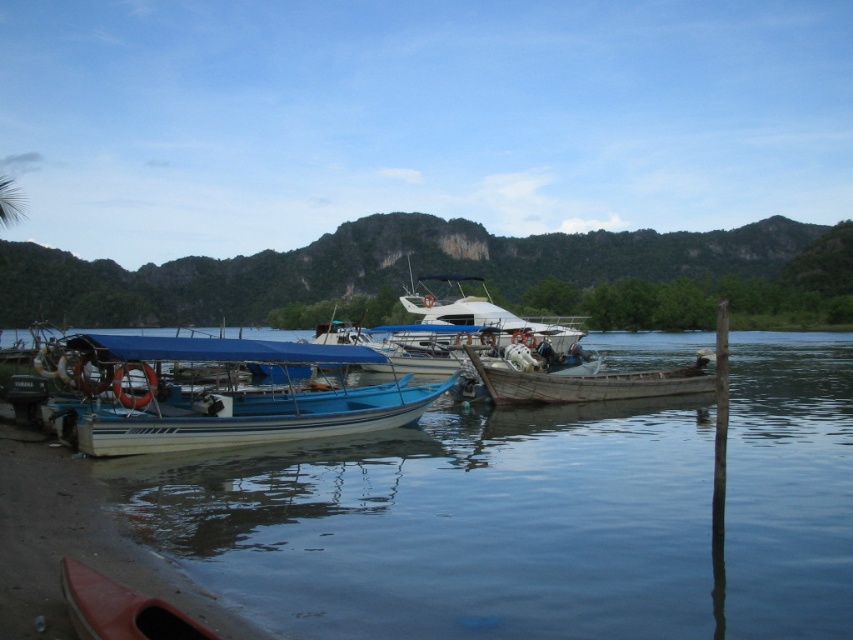
The width and height of the screenshot is (853, 640). What do you see at coordinates (589, 384) in the screenshot? I see `wooden boat at center` at bounding box center [589, 384].

Is wooden boat at center positioned at the back of matte orange canoe at lower left?

Yes, it is.

What do you see at coordinates (589, 384) in the screenshot? I see `wooden boat at center` at bounding box center [589, 384].

Identify the location of wooden boat at center. (589, 384).

Can you confirm if wooden boat at center is smaller than white glossy yacht at center?

Indeed, wooden boat at center has a smaller size compared to white glossy yacht at center.

Which of these two, wooden boat at center or white glossy yacht at center, stands taller?

With more height is white glossy yacht at center.

Who is more forward, (520, 401) or (426, 300)?

Positioned in front is point (520, 401).

Locate an element on the screen. wooden boat at center is located at coordinates (589, 384).

Which of these two, matte orange canoe at lower left or white glossy yacht at center, stands shorter?

With less height is matte orange canoe at lower left.

Is point (171, 628) positioned before point (430, 276)?

Yes, it is.

What do you see at coordinates (120, 609) in the screenshot? I see `matte orange canoe at lower left` at bounding box center [120, 609].

The image size is (853, 640). What are the coordinates of `matte orange canoe at lower left` in the screenshot? It's located at (120, 609).